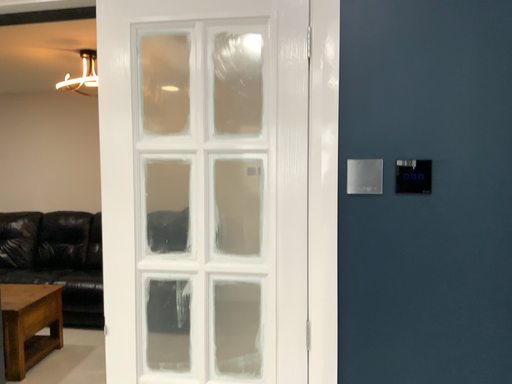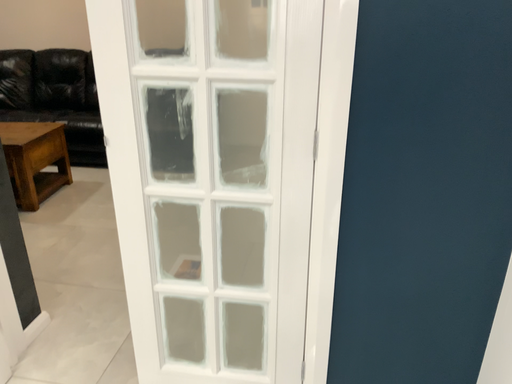
Question: Which way did the camera rotate in the video?

Choices:
 (A) rotated upward
 (B) rotated downward

Answer: (B)